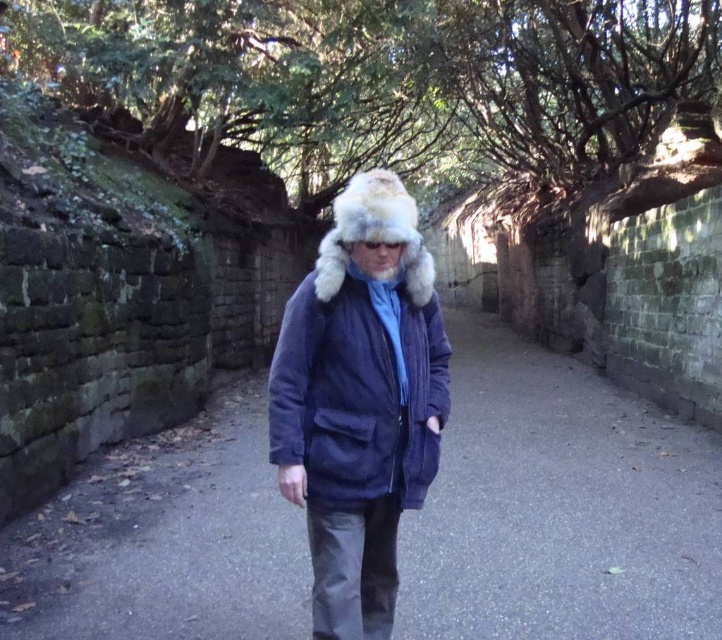
Question: Is navy blue fur-lined coat at center to the left of navy corduroy jacket at center from the viewer's perspective?

Choices:
 (A) no
 (B) yes

Answer: (B)

Question: Is navy corduroy jacket at center to the right of white fur hat at center from the viewer's perspective?

Choices:
 (A) no
 (B) yes

Answer: (B)

Question: Which object is the closest to the white fur hat at center?

Choices:
 (A) navy blue fur-lined coat at center
 (B) navy corduroy jacket at center

Answer: (B)

Question: Which object appears farthest from the camera in this image?

Choices:
 (A) navy corduroy jacket at center
 (B) navy blue fur-lined coat at center

Answer: (B)

Question: Is navy corduroy jacket at center below white fur hat at center?

Choices:
 (A) no
 (B) yes

Answer: (B)

Question: Considering the real-world distances, which object is farthest from the white fur hat at center?

Choices:
 (A) navy corduroy jacket at center
 (B) navy blue fur-lined coat at center

Answer: (B)